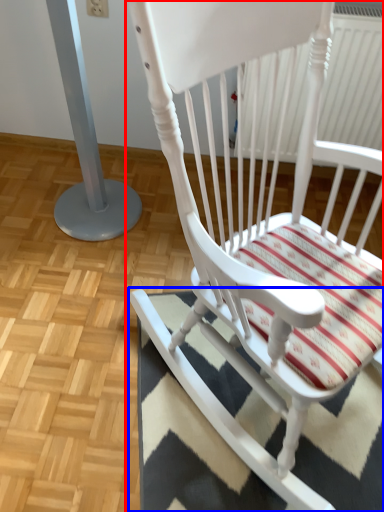
Question: Which point is closer to the camera, chair (highlighted by a red box) or doormat (highlighted by a blue box)?

Choices:
 (A) chair
 (B) doormat

Answer: (A)